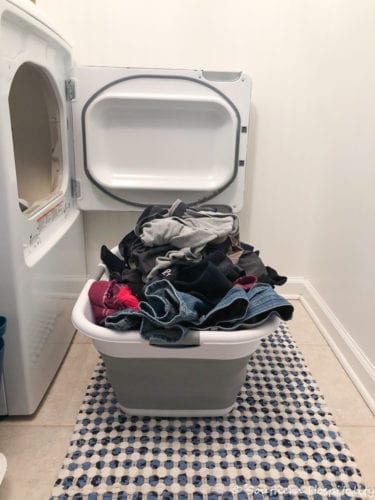
Locate an element on the screen. manufacturer's label on dryer is located at coordinates [x=50, y=216].